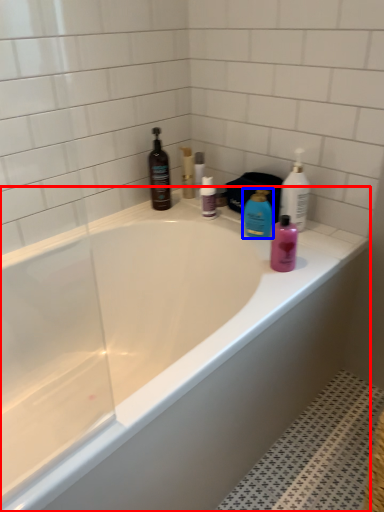
Question: Which object appears farthest to the camera in this image, bathtub (highlighted by a red box) or cleaning product (highlighted by a blue box)?

Choices:
 (A) bathtub
 (B) cleaning product

Answer: (B)